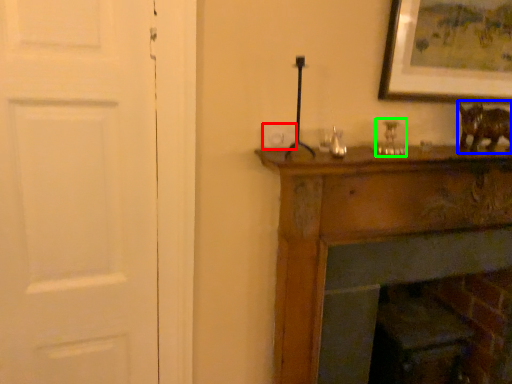
Question: Considering the real-world distances, which object is closest to light switch (highlighted by a red box)? animal (highlighted by a blue box) or candle holder (highlighted by a green box).

Choices:
 (A) animal
 (B) candle holder

Answer: (B)